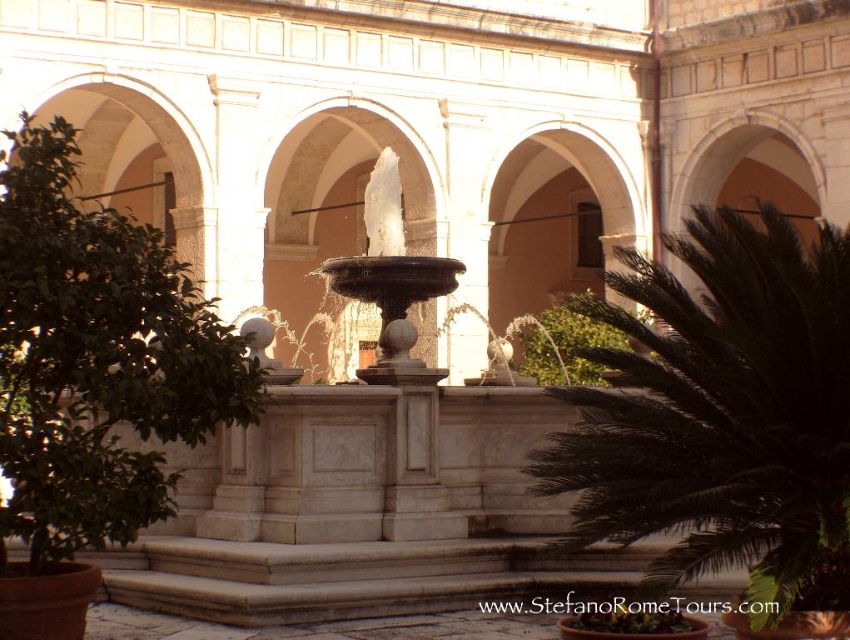
Question: In this image, where is green leafy tree at left located relative to white marble fountain at center?

Choices:
 (A) left
 (B) right

Answer: (A)

Question: Does white marble fountain at center lie behind green leafy plant at center?

Choices:
 (A) yes
 (B) no

Answer: (A)

Question: Which point is farther to the camera?

Choices:
 (A) (34, 444)
 (B) (571, 304)
 (C) (445, 276)
 (D) (571, 440)

Answer: (B)

Question: Based on their relative distances, which object is farther from the dark green leafy palm at right?

Choices:
 (A) green leafy plant at center
 (B) green leafy tree at left
 (C) white marble fountain at center

Answer: (B)

Question: Which object is farther from the camera taking this photo?

Choices:
 (A) green leafy tree at left
 (B) green leafy plant at center

Answer: (B)

Question: Can you confirm if white marble fountain at center is bigger than green leafy plant at center?

Choices:
 (A) no
 (B) yes

Answer: (B)